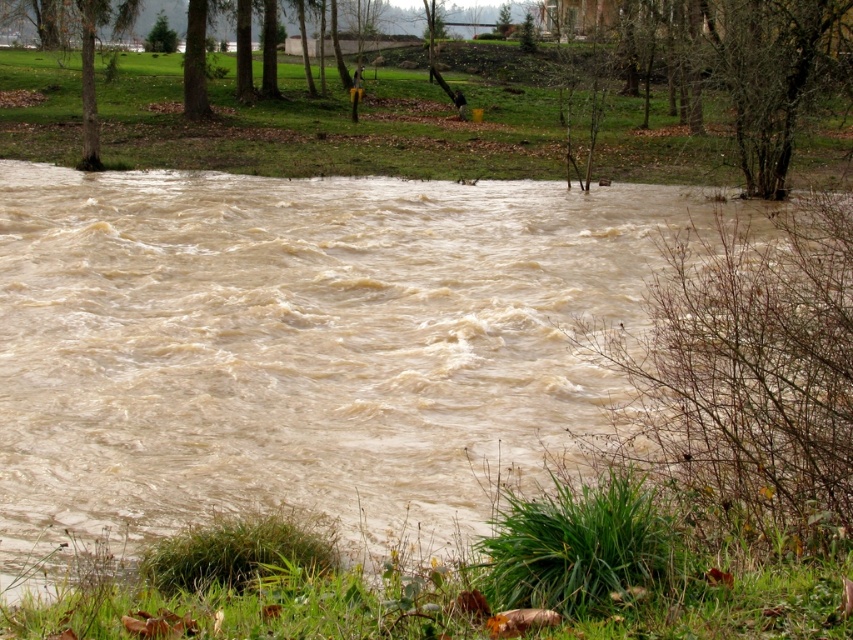
Is point (602, 372) positioned before point (146, 49)?

Yes.

Measure the distance between brown muddy water at center and green matte tree at upper left.

The distance of brown muddy water at center from green matte tree at upper left is 62.35 meters.

Which is behind, point (399, 355) or point (161, 49)?

The point (161, 49) is behind.

What are the coordinates of `brown muddy water at center` in the screenshot? It's located at (302, 346).